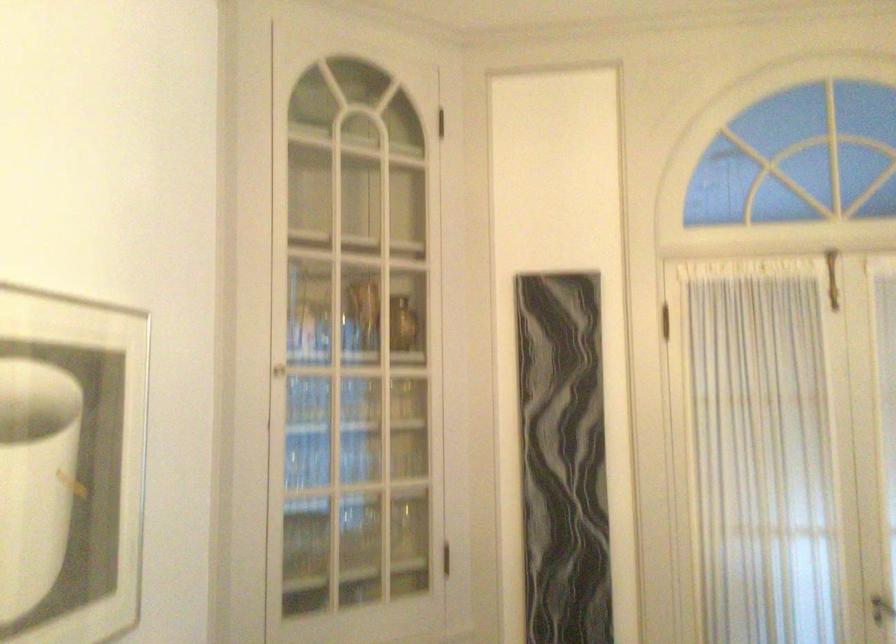
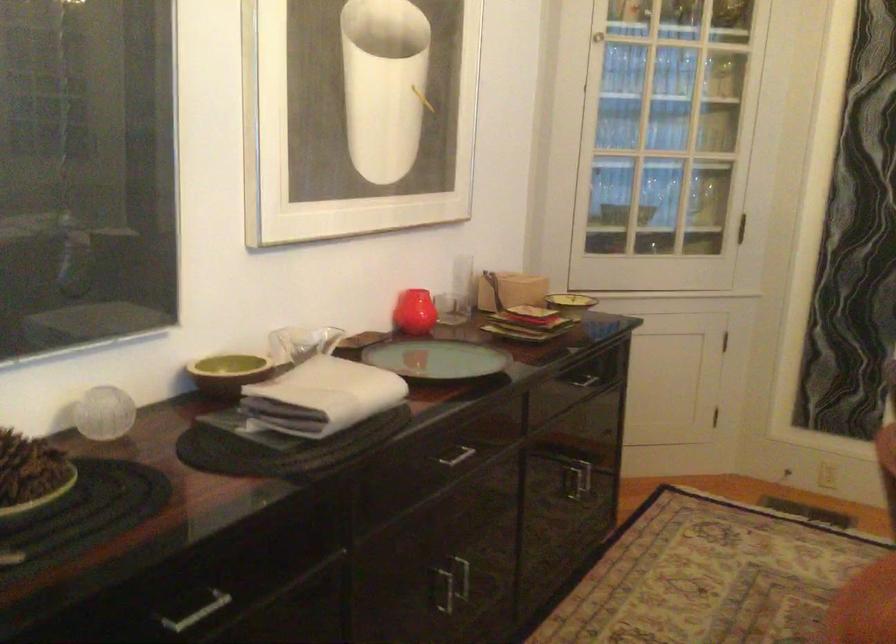
In the second image, find the point that corresponds to [280,371] in the first image.

(597, 37)